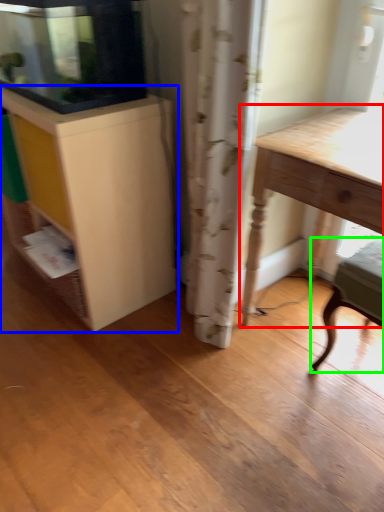
Question: Estimate the real-world distances between objects in this image. Which object is farther from table (highlighted by a red box), cabinetry (highlighted by a blue box) or chair (highlighted by a green box)?

Choices:
 (A) cabinetry
 (B) chair

Answer: (A)